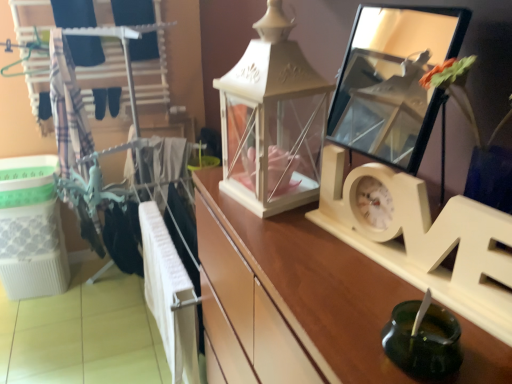
Question: Does white wood clock at center have a lesser width compared to clear glass mirror at upper right?

Choices:
 (A) no
 (B) yes

Answer: (B)

Question: Is white wood clock at center at the left side of clear glass mirror at upper right?

Choices:
 (A) no
 (B) yes

Answer: (B)

Question: From the image's perspective, does white wood clock at center appear higher than clear glass mirror at upper right?

Choices:
 (A) no
 (B) yes

Answer: (A)

Question: Is the position of white wood clock at center less distant than that of clear glass mirror at upper right?

Choices:
 (A) no
 (B) yes

Answer: (B)

Question: Does white wood clock at center turn towards clear glass mirror at upper right?

Choices:
 (A) no
 (B) yes

Answer: (A)

Question: From the image's perspective, is white wood clock at center located beneath clear glass mirror at upper right?

Choices:
 (A) yes
 (B) no

Answer: (A)

Question: Does white wood clock at center have a smaller size compared to plaid fabric at left?

Choices:
 (A) yes
 (B) no

Answer: (A)

Question: Does white wood clock at center lie behind plaid fabric at left?

Choices:
 (A) yes
 (B) no

Answer: (B)

Question: Is white wood clock at center facing towards plaid fabric at left?

Choices:
 (A) yes
 (B) no

Answer: (B)

Question: Can you confirm if white wood clock at center is thinner than plaid fabric at left?

Choices:
 (A) no
 (B) yes

Answer: (B)

Question: From the image's perspective, is white wood clock at center beneath plaid fabric at left?

Choices:
 (A) no
 (B) yes

Answer: (B)

Question: Considering the relative sizes of white wood clock at center and plaid fabric at left in the image provided, is white wood clock at center bigger than plaid fabric at left?

Choices:
 (A) no
 (B) yes

Answer: (A)

Question: From the image's perspective, would you say clear glass mirror at upper right is positioned over plaid fabric at left?

Choices:
 (A) no
 (B) yes

Answer: (A)